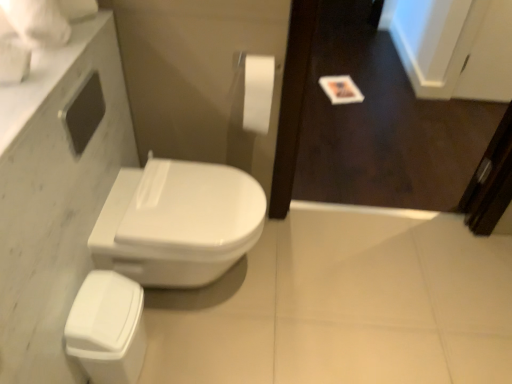
Measure the distance between white glossy bidet at center and camera.

A distance of 1.27 meters exists between white glossy bidet at center and camera.

The height and width of the screenshot is (384, 512). What do you see at coordinates (108, 328) in the screenshot?
I see `white glossy porcelain at lower left` at bounding box center [108, 328].

This screenshot has width=512, height=384. Identify the location of white glossy bidet at center. (177, 222).

From a real-world perspective, which is physically below, white glossy bidet at center or wooden screen door at upper right?

From a 3D spatial view, white glossy bidet at center is below.

Considering the relative sizes of white glossy bidet at center and wooden screen door at upper right in the image provided, is white glossy bidet at center wider than wooden screen door at upper right?

Indeed, white glossy bidet at center has a greater width compared to wooden screen door at upper right.

Is white glossy bidet at center positioned with its back to wooden screen door at upper right?

No, wooden screen door at upper right is not at the back of white glossy bidet at center.

Considering the sizes of white glossy bidet at center and wooden screen door at upper right in the image, is white glossy bidet at center bigger or smaller than wooden screen door at upper right?

Clearly, white glossy bidet at center is smaller in size than wooden screen door at upper right.

In the image, there is a white marble countertop at upper left. At what (x,y) coordinates should I click in order to perform the action: click on porcelain below it (from a real-world perspective). Please return your answer as a coordinate pair (x, y). The image size is (512, 384). Looking at the image, I should click on (108, 328).

Does white glossy porcelain at lower left have a lesser width compared to white marble countertop at upper left?

Yes, white glossy porcelain at lower left is thinner than white marble countertop at upper left.

From the image's perspective, between white glossy porcelain at lower left and white marble countertop at upper left, who is located below?

white glossy porcelain at lower left.

Is white glossy porcelain at lower left located outside white marble countertop at upper left?

Yes, white glossy porcelain at lower left is outside of white marble countertop at upper left.

Find the location of a particular element. toilet paper located behind the white glossy bidet at center is located at coordinates pos(258,92).

From the image's perspective, which is below, white matte toilet paper at upper center or white glossy bidet at center?

white glossy bidet at center appears lower in the image.

How many degrees apart are the facing directions of white glossy porcelain at lower left and wooden screen door at upper right?

90.5 degrees.

Which is closer to the camera, (76, 326) or (310, 165)?

Point (76, 326) is positioned closer to the camera compared to point (310, 165).

Would you say white glossy porcelain at lower left is to the left or to the right of wooden screen door at upper right in the picture?

white glossy porcelain at lower left is to the left of wooden screen door at upper right.

Which of these two, white glossy porcelain at lower left or wooden screen door at upper right, is wider?

Wider between the two is white glossy porcelain at lower left.

Is the position of wooden screen door at upper right less distant than that of white matte toilet paper at upper center?

Yes, wooden screen door at upper right is in front of white matte toilet paper at upper center.

Which point is more distant from viewer, (373, 144) or (272, 66)?

The point (373, 144) is more distant.

From a real-world perspective, who is located higher, wooden screen door at upper right or white matte toilet paper at upper center?

white matte toilet paper at upper center.

Can you confirm if white marble countertop at upper left is bigger than white matte toilet paper at upper center?

Yes.

Is white marble countertop at upper left far away from white matte toilet paper at upper center?

They are positioned close to each other.

Where is `toilet paper lying on the right of white marble countertop at upper left`? This screenshot has width=512, height=384. toilet paper lying on the right of white marble countertop at upper left is located at coordinates tap(258, 92).

Could white matte toilet paper at upper center be considered to be inside white marble countertop at upper left?

Definitely not — white matte toilet paper at upper center is not inside white marble countertop at upper left.

Is white glossy bidet at center to the left of white marble countertop at upper left from the viewer's perspective?

No, white glossy bidet at center is not to the left of white marble countertop at upper left.

From the image's perspective, which is above, white glossy bidet at center or white marble countertop at upper left?

white marble countertop at upper left.

Is white glossy bidet at center inside the boundaries of white marble countertop at upper left, or outside?

The correct answer is: outside.

Does white glossy bidet at center have a smaller size compared to white marble countertop at upper left?

No.

What are the coordinates of `screen door above the white glossy bidet at center (from the image's perspective)` in the screenshot? It's located at (382, 124).

Image resolution: width=512 pixels, height=384 pixels. I want to click on porcelain behind the white marble countertop at upper left, so click(108, 328).

Which object lies further to the anchor point white glossy porcelain at lower left, white glossy bidet at center or white matte toilet paper at upper center?

white matte toilet paper at upper center lies further to white glossy porcelain at lower left than the other object.

When comparing their distances from white glossy porcelain at lower left, does white glossy bidet at center or white marble countertop at upper left seem closer?

white glossy bidet at center is closer to white glossy porcelain at lower left.

When comparing their distances from wooden screen door at upper right, does white glossy bidet at center or white glossy porcelain at lower left seem further?

white glossy porcelain at lower left.

Which object lies further to the anchor point white glossy bidet at center, white glossy porcelain at lower left or white marble countertop at upper left?

The object further to white glossy bidet at center is white marble countertop at upper left.

Which object lies further to the anchor point wooden screen door at upper right, white marble countertop at upper left or white glossy porcelain at lower left?

white marble countertop at upper left lies further to wooden screen door at upper right than the other object.

Looking at the image, which one is located further to white matte toilet paper at upper center, white marble countertop at upper left or white glossy porcelain at lower left?

white glossy porcelain at lower left is further to white matte toilet paper at upper center.

Estimate the real-world distances between objects in this image. Which object is further from wooden screen door at upper right, white matte toilet paper at upper center or white glossy porcelain at lower left?

Among the two, white glossy porcelain at lower left is located further to wooden screen door at upper right.

Looking at this image, when comparing their distances from white glossy porcelain at lower left, does white marble countertop at upper left or white matte toilet paper at upper center seem closer?

The object closer to white glossy porcelain at lower left is white marble countertop at upper left.

I want to click on counter top between white matte toilet paper at upper center and white glossy porcelain at lower left in the up-down direction, so click(42, 79).

What are the coordinates of `porcelain between white marble countertop at upper left and wooden screen door at upper right` in the screenshot? It's located at (108, 328).

Where is `bidet between white matte toilet paper at upper center and white glossy porcelain at lower left from top to bottom`? This screenshot has height=384, width=512. bidet between white matte toilet paper at upper center and white glossy porcelain at lower left from top to bottom is located at coordinates (177, 222).

Locate an element on the screen. The width and height of the screenshot is (512, 384). toilet paper situated between white marble countertop at upper left and wooden screen door at upper right from left to right is located at coordinates (258, 92).